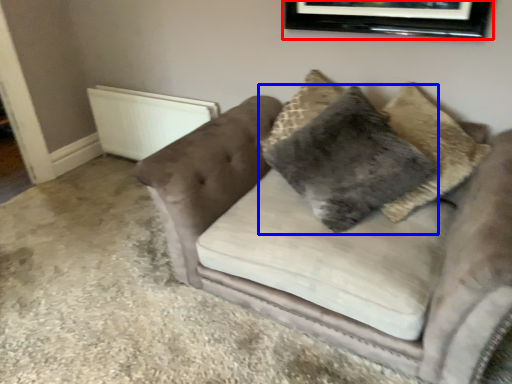
Question: Which object is closer to the camera taking this photo, picture frame (highlighted by a red box) or pillow (highlighted by a blue box)?

Choices:
 (A) picture frame
 (B) pillow

Answer: (B)